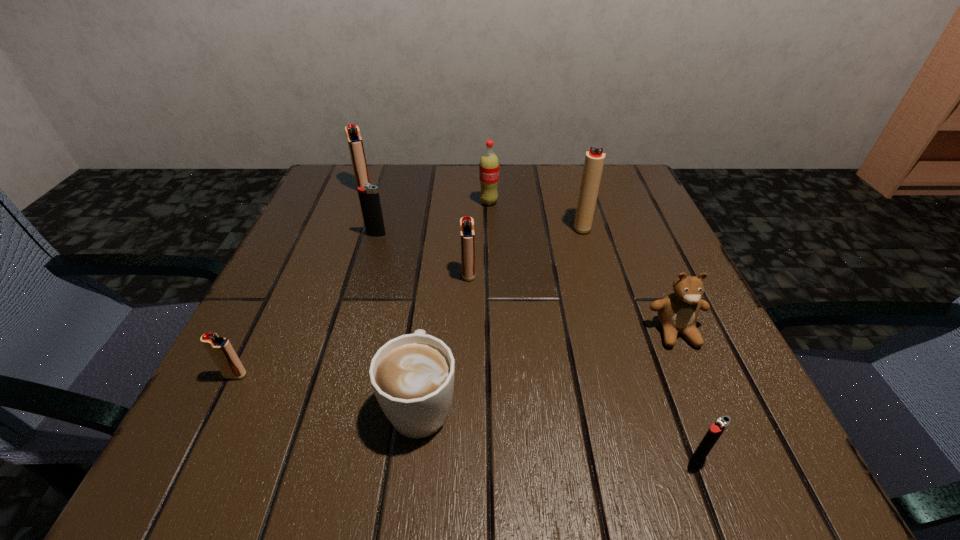
Locate an element on the screen. The height and width of the screenshot is (540, 960). the tallest igniter is located at coordinates (594, 160).

Where is `the tallest object`? Image resolution: width=960 pixels, height=540 pixels. the tallest object is located at coordinates (594, 160).

Identify the location of the second biggest red igniter. (355, 143).

Where is `the eighth object from right to left`? the eighth object from right to left is located at coordinates (355, 143).

Locate an element on the screen. the second farthest object is located at coordinates (489, 164).

In order to click on the fourth object from right to left in this screenshot , I will do pyautogui.click(x=489, y=164).

At what (x,y) coordinates should I click in order to perform the action: click on the third igniter from left to right. Please return your answer as a coordinate pair (x, y). Looking at the image, I should click on (369, 198).

Locate an element on the screen. the bigger black igniter is located at coordinates (369, 198).

Where is `the second nearest red igniter`? Image resolution: width=960 pixels, height=540 pixels. the second nearest red igniter is located at coordinates (467, 235).

Image resolution: width=960 pixels, height=540 pixels. What are the coordinates of `the third igniter from right to left` in the screenshot? It's located at (467, 235).